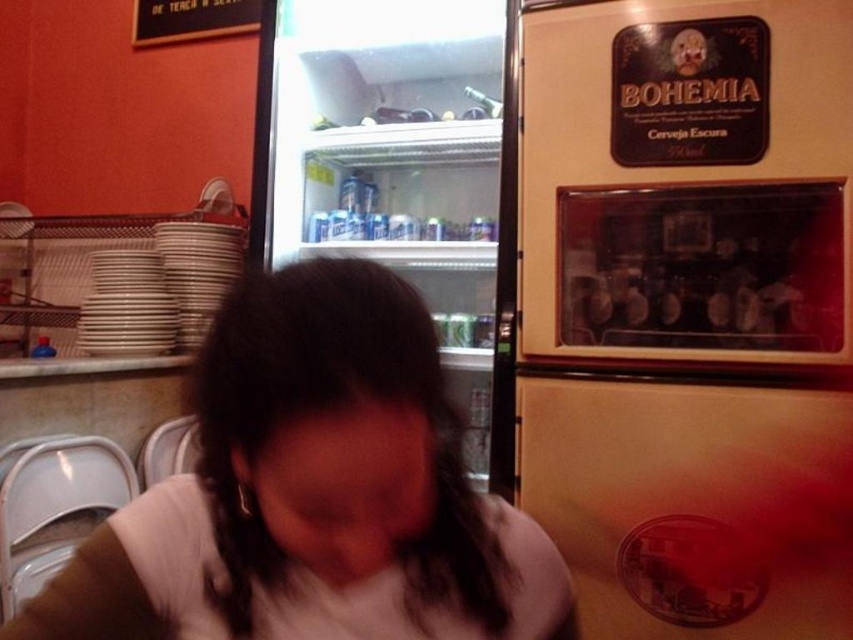
Question: Which of the following is the closest to the observer?

Choices:
 (A) (241, 433)
 (B) (312, 173)
 (C) (253, 13)
 (D) (848, 218)

Answer: (A)

Question: Is matte cream refrigerator at right to the left of clear glass fridge at center from the viewer's perspective?

Choices:
 (A) yes
 (B) no

Answer: (B)

Question: Does clear glass fridge at center appear over black wood sign at upper left?

Choices:
 (A) no
 (B) yes

Answer: (A)

Question: Which of the following is the closest to the observer?

Choices:
 (A) (138, 1)
 (B) (518, 193)
 (C) (399, 49)
 (D) (479, 611)

Answer: (D)

Question: Does matte cream refrigerator at right appear over white matte shirt at center?

Choices:
 (A) yes
 (B) no

Answer: (A)

Question: Which point is closer to the camera?

Choices:
 (A) (351, 241)
 (B) (321, 522)
 (C) (144, 6)
 (D) (534, 3)

Answer: (B)